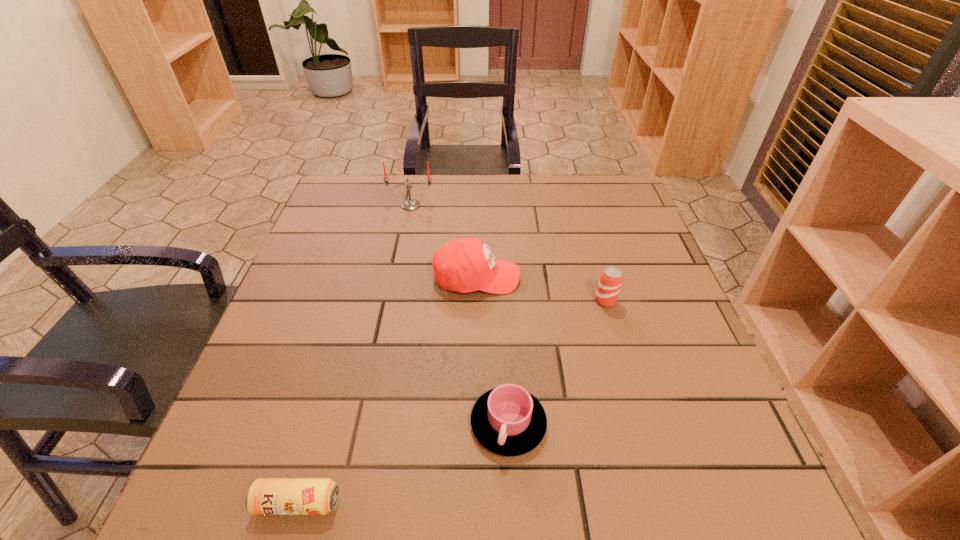
This screenshot has width=960, height=540. What are the coordinates of `the farthest object` in the screenshot? It's located at (410, 204).

Image resolution: width=960 pixels, height=540 pixels. I want to click on the tallest object, so click(410, 204).

Locate an element on the screen. baseball cap is located at coordinates (464, 265).

The image size is (960, 540). Find the location of `the third shortest object`. the third shortest object is located at coordinates (611, 278).

You are a GUI agent. You are given a task and a screenshot of the screen. Output one action in this format:
    pyautogui.click(x=<x>, y=<y>)
    Task: Click on the rightmost object
    The image size is (960, 540).
    Given the screenshot: What is the action you would take?
    pyautogui.click(x=611, y=278)

Where is `cup`? The image size is (960, 540). cup is located at coordinates (508, 420).

At what (x,y) coordinates should I click in order to perform the action: click on the fourth farthest object. Please return your answer as a coordinate pair (x, y). Image resolution: width=960 pixels, height=540 pixels. Looking at the image, I should click on (508, 420).

This screenshot has width=960, height=540. I want to click on the nearer beer can, so click(x=266, y=496).

Locate an element on the screen. This screenshot has width=960, height=540. the shortest object is located at coordinates (266, 496).

I want to click on vacant point located on the front-facing side of the candle, so click(395, 284).